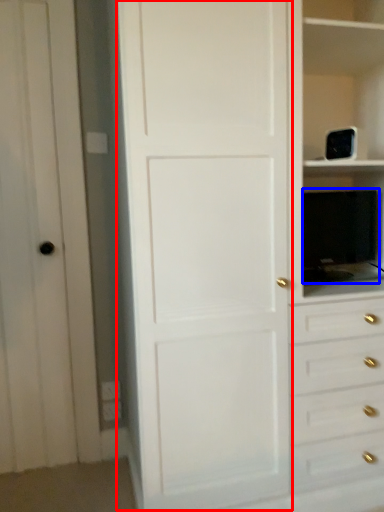
Question: Which point is closer to the camera, door (highlighted by a red box) or appliance (highlighted by a blue box)?

Choices:
 (A) door
 (B) appliance

Answer: (A)